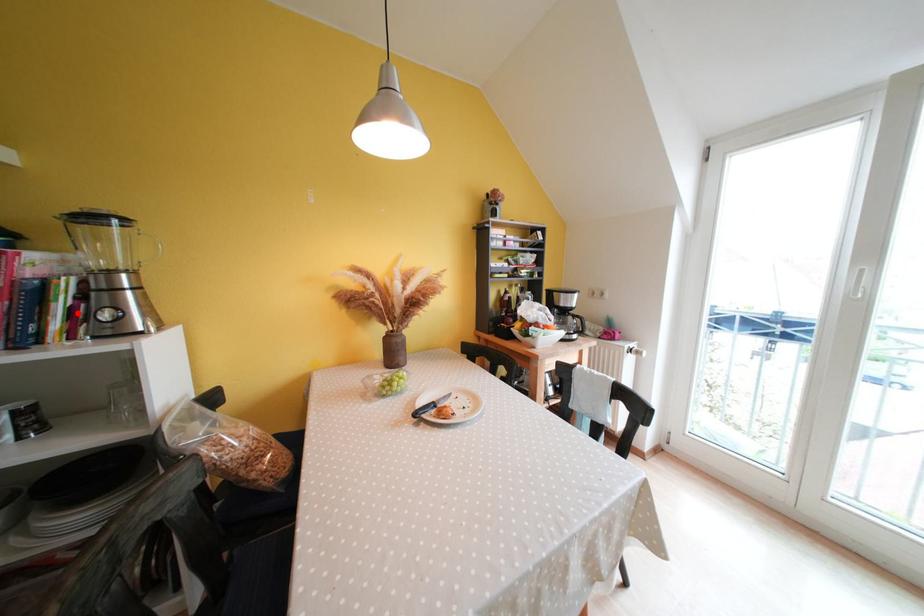
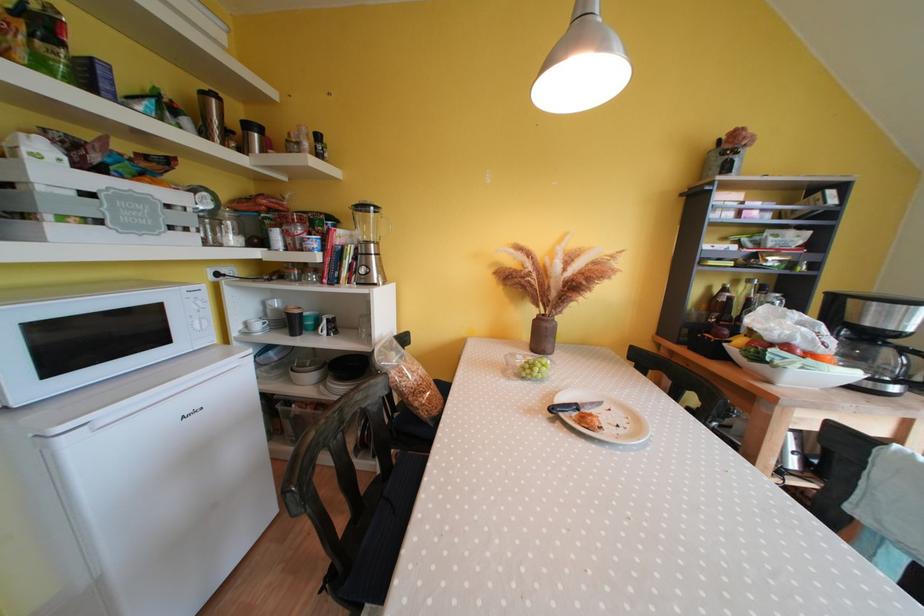
Where in the second image is the point corresponding to the highlighted location from the first image?

(357, 269)